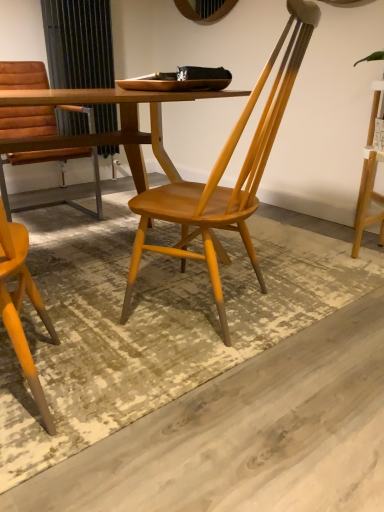
The width and height of the screenshot is (384, 512). Identify the location of empty space that is to the right of wooden chair at center, which is the first chair in front-to-back order. (314, 288).